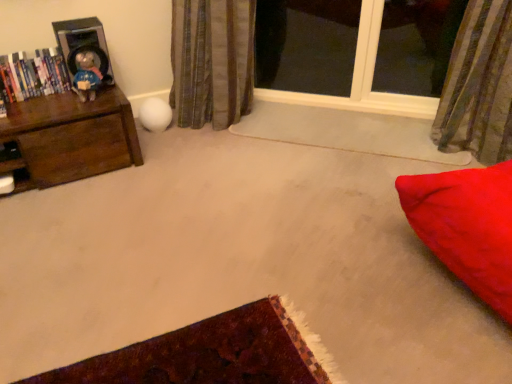
Question: Considering the relative positions of matte plastic doll at left and transparent glass window at upper center in the image provided, is matte plastic doll at left to the right of transparent glass window at upper center from the viewer's perspective?

Choices:
 (A) yes
 (B) no

Answer: (B)

Question: From a real-world perspective, is matte plastic doll at left located higher than transparent glass window at upper center?

Choices:
 (A) no
 (B) yes

Answer: (B)

Question: Is matte plastic doll at left far from transparent glass window at upper center?

Choices:
 (A) no
 (B) yes

Answer: (B)

Question: From the image's perspective, is matte plastic doll at left located above transparent glass window at upper center?

Choices:
 (A) yes
 (B) no

Answer: (B)

Question: Can you confirm if matte plastic doll at left is wider than transparent glass window at upper center?

Choices:
 (A) no
 (B) yes

Answer: (A)

Question: Is matte plastic doll at left oriented away from transparent glass window at upper center?

Choices:
 (A) no
 (B) yes

Answer: (A)

Question: Considering the relative sizes of hardcover books at left and white fabric curtain at upper left, the 1th curtain viewed from the left, in the image provided, is hardcover books at left taller than white fabric curtain at upper left, the 1th curtain viewed from the left,?

Choices:
 (A) yes
 (B) no

Answer: (B)

Question: Are hardcover books at left and white fabric curtain at upper left, the 1th curtain viewed from the left, located far from each other?

Choices:
 (A) no
 (B) yes

Answer: (A)

Question: Would you say hardcover books at left contains white fabric curtain at upper left, the 1th curtain viewed from the left?

Choices:
 (A) no
 (B) yes

Answer: (A)

Question: Could you tell me if hardcover books at left is turned towards white fabric curtain at upper left, the 1th curtain viewed from the left?

Choices:
 (A) yes
 (B) no

Answer: (B)

Question: Considering the relative sizes of hardcover books at left and white fabric curtain at upper left, placed as the second curtain when sorted from right to left, in the image provided, is hardcover books at left wider than white fabric curtain at upper left, placed as the second curtain when sorted from right to left,?

Choices:
 (A) no
 (B) yes

Answer: (A)

Question: Considering the relative positions of hardcover books at left and white fabric curtain at upper left, placed as the second curtain when sorted from right to left, in the image provided, is hardcover books at left behind white fabric curtain at upper left, placed as the second curtain when sorted from right to left,?

Choices:
 (A) no
 (B) yes

Answer: (A)

Question: Is metallic silver speaker at upper left closer to camera compared to hardcover books at left?

Choices:
 (A) yes
 (B) no

Answer: (B)